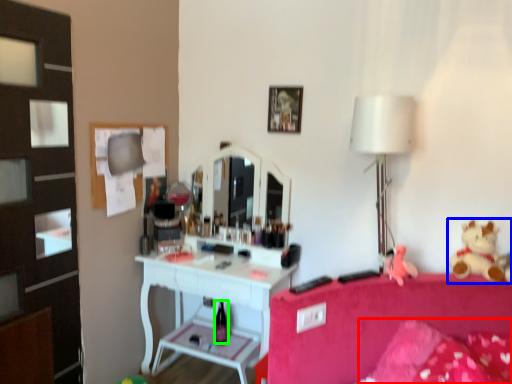
Question: Considering the real-world distances, which object is farthest from pillow (highlighted by a red box)? teddy bear (highlighted by a blue box) or bottle (highlighted by a green box)?

Choices:
 (A) teddy bear
 (B) bottle

Answer: (B)